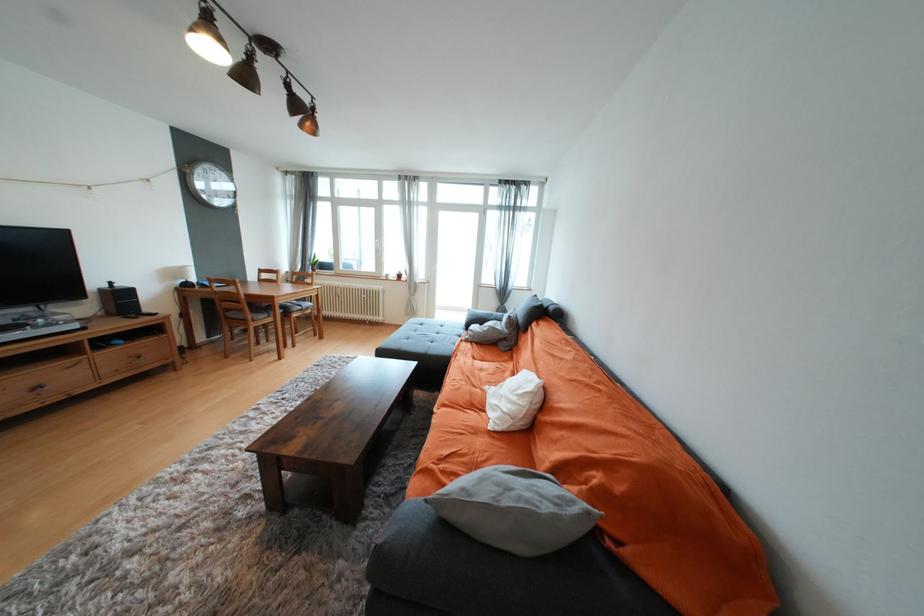
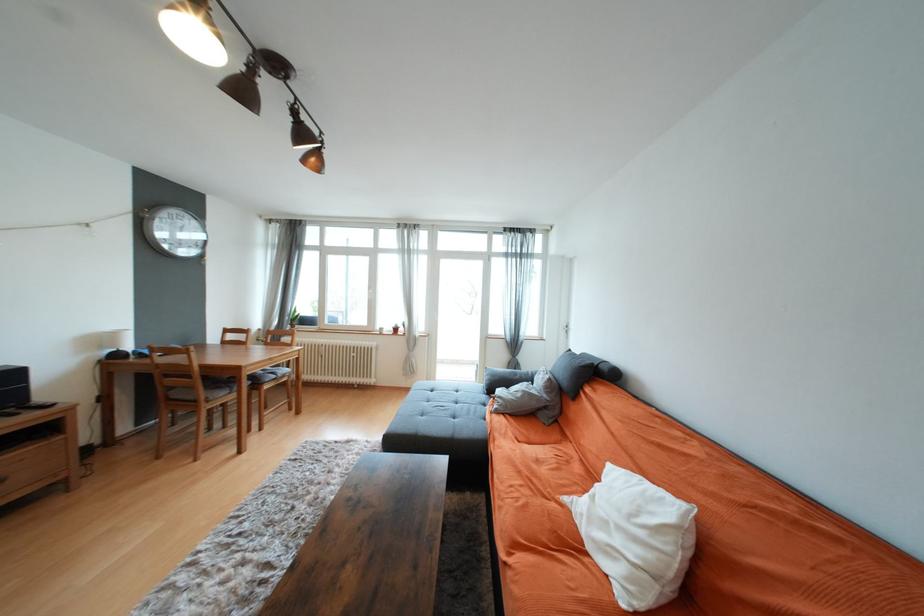
Question: The first image is from the beginning of the video and the second image is from the end. How did the camera likely rotate when shooting the video?

Choices:
 (A) Left
 (B) Right
 (C) Up
 (D) Down

Answer: (C)